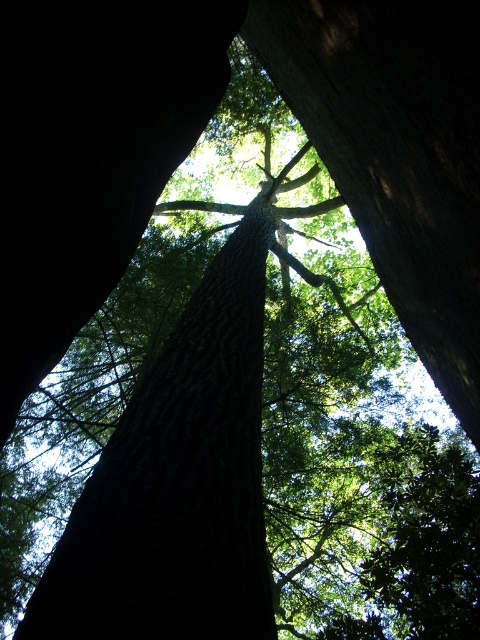
You are a hiker trying to identify the thinnest tree trunk in the center of the image. Which one between the dark brown rough tree trunk at center and the dark brown textured tree trunk at center is thinner?

The dark brown rough tree trunk at center is thinner than the dark brown textured tree trunk at center.